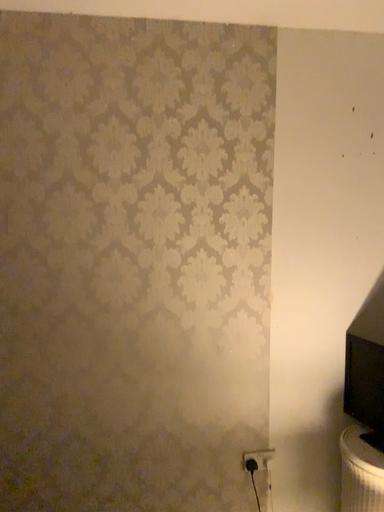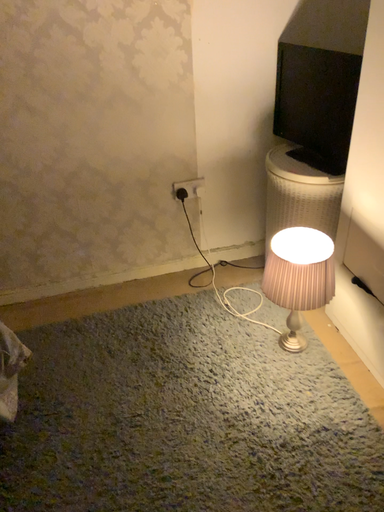
Question: Which way did the camera rotate in the video?

Choices:
 (A) rotated downward
 (B) rotated upward

Answer: (A)